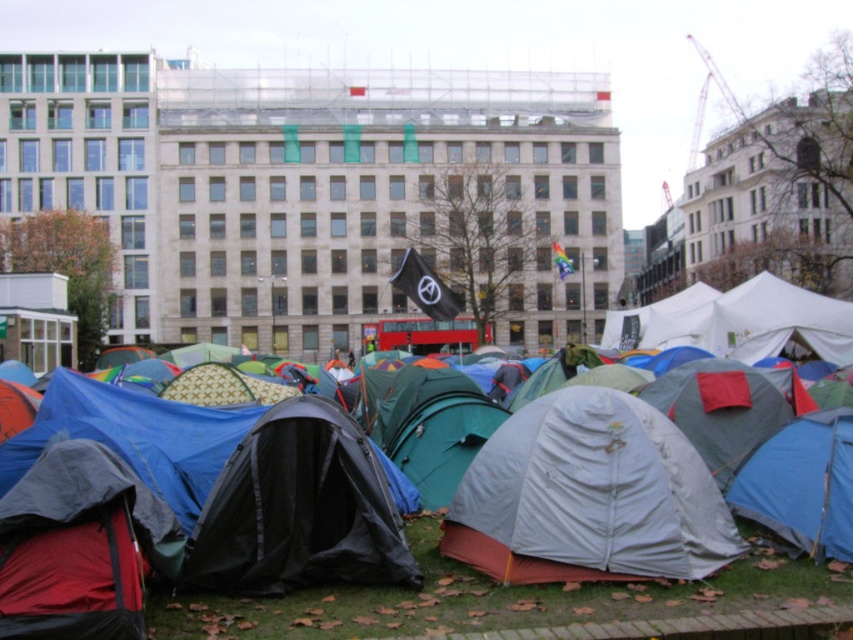
Question: Which point is farther from the camera taking this photo?

Choices:
 (A) (67, 385)
 (B) (640, 556)

Answer: (A)

Question: Considering the relative positions of multicolored tents at center and white matte tent at center in the image provided, where is multicolored tents at center located with respect to white matte tent at center?

Choices:
 (A) right
 (B) left

Answer: (B)

Question: Is multicolored tents at center closer to the viewer compared to white matte tent at center?

Choices:
 (A) no
 (B) yes

Answer: (A)

Question: Which point is farther to the camera?

Choices:
 (A) white matte tent at center
 (B) multicolored tents at center

Answer: (B)

Question: Can you confirm if multicolored tents at center is thinner than white matte tent at center?

Choices:
 (A) yes
 (B) no

Answer: (A)